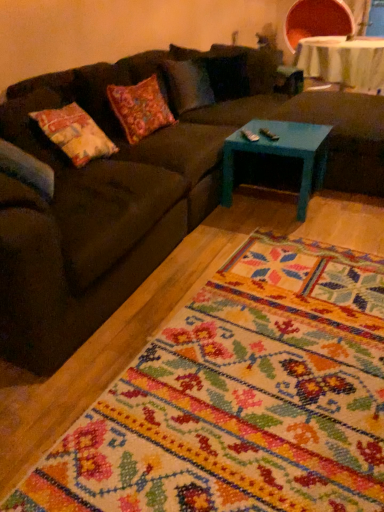
Question: Visually, is dark brown fabric couch at center positioned to the left or to the right of teal painted wood coffee table at center?

Choices:
 (A) right
 (B) left

Answer: (B)

Question: Considering their positions, is dark brown fabric couch at center located in front of or behind teal painted wood coffee table at center?

Choices:
 (A) behind
 (B) front

Answer: (B)

Question: Which is farther from the dark brown fabric couch at center?

Choices:
 (A) teal painted wood coffee table at center
 (B) white fabric table at upper right
 (C) teal painted wood footrest at center
 (D) floral carpet at center

Answer: (B)

Question: Based on their relative distances, which object is nearer to the white fabric table at upper right?

Choices:
 (A) dark brown fabric couch at center
 (B) floral carpet at center
 (C) teal painted wood footrest at center
 (D) teal painted wood coffee table at center

Answer: (C)